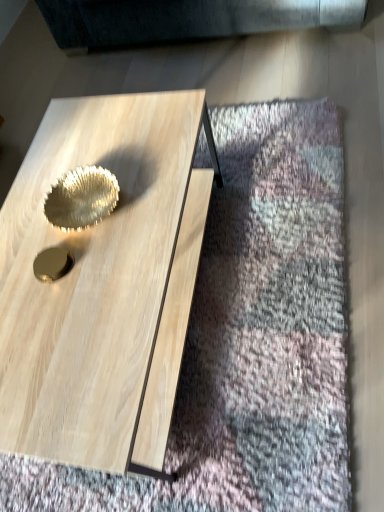
Question: From a real-world perspective, is natural wood coffee table at center beneath shiny metallic bowl at center?

Choices:
 (A) no
 (B) yes

Answer: (B)

Question: Is natural wood coffee table at center smaller than shiny metallic bowl at center?

Choices:
 (A) no
 (B) yes

Answer: (A)

Question: Is natural wood coffee table at center behind shiny metallic bowl at center?

Choices:
 (A) yes
 (B) no

Answer: (B)

Question: Is natural wood coffee table at center at the right side of shiny metallic bowl at center?

Choices:
 (A) no
 (B) yes

Answer: (B)

Question: Does natural wood coffee table at center have a lesser width compared to shiny metallic bowl at center?

Choices:
 (A) yes
 (B) no

Answer: (B)

Question: From the image's perspective, is natural wood coffee table at center on top of shiny metallic bowl at center?

Choices:
 (A) no
 (B) yes

Answer: (A)

Question: Considering the relative sizes of shiny metallic bowl at center and natural wood coffee table at center in the image provided, is shiny metallic bowl at center smaller than natural wood coffee table at center?

Choices:
 (A) no
 (B) yes

Answer: (B)

Question: Could you tell me if shiny metallic bowl at center is turned towards natural wood coffee table at center?

Choices:
 (A) no
 (B) yes

Answer: (A)

Question: Can you confirm if shiny metallic bowl at center is wider than natural wood coffee table at center?

Choices:
 (A) yes
 (B) no

Answer: (B)

Question: Considering the relative sizes of shiny metallic bowl at center and natural wood coffee table at center in the image provided, is shiny metallic bowl at center shorter than natural wood coffee table at center?

Choices:
 (A) yes
 (B) no

Answer: (A)

Question: Does shiny metallic bowl at center lie behind natural wood coffee table at center?

Choices:
 (A) no
 (B) yes

Answer: (B)

Question: Considering the relative sizes of shiny metallic bowl at center and natural wood coffee table at center in the image provided, is shiny metallic bowl at center bigger than natural wood coffee table at center?

Choices:
 (A) no
 (B) yes

Answer: (A)

Question: Looking at their shapes, would you say shiny metallic bowl at center is wider or thinner than natural wood coffee table at center?

Choices:
 (A) wide
 (B) thin

Answer: (B)